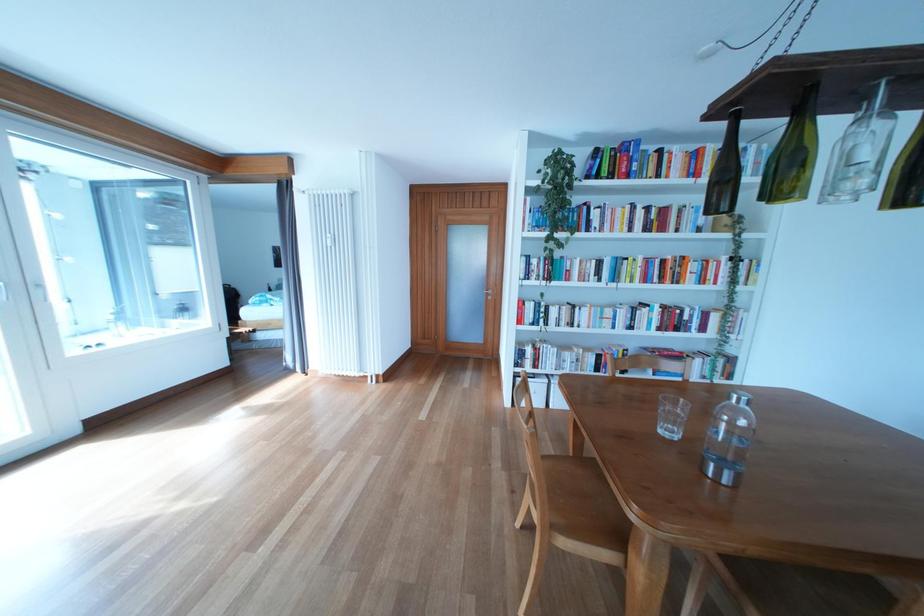
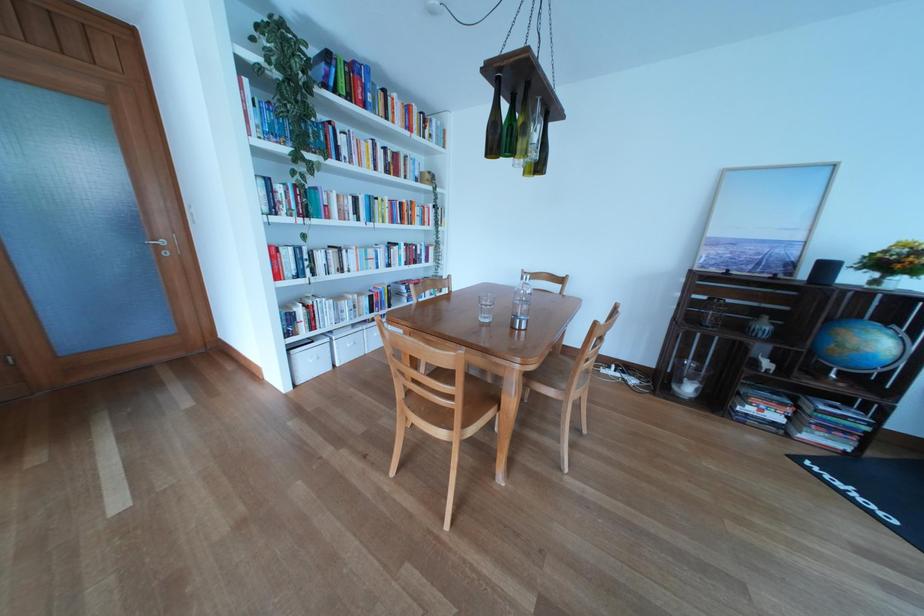
Question: The images are taken continuously from a first-person perspective. In which direction is your viewpoint rotating?

Choices:
 (A) Left
 (B) Right
 (C) Up
 (D) Down

Answer: (B)